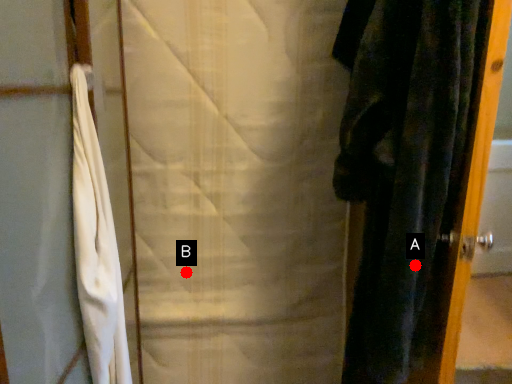
Question: Two points are circled on the image, labeled by A and B beside each circle. Which point is closer to the camera?

Choices:
 (A) A is closer
 (B) B is closer

Answer: (A)